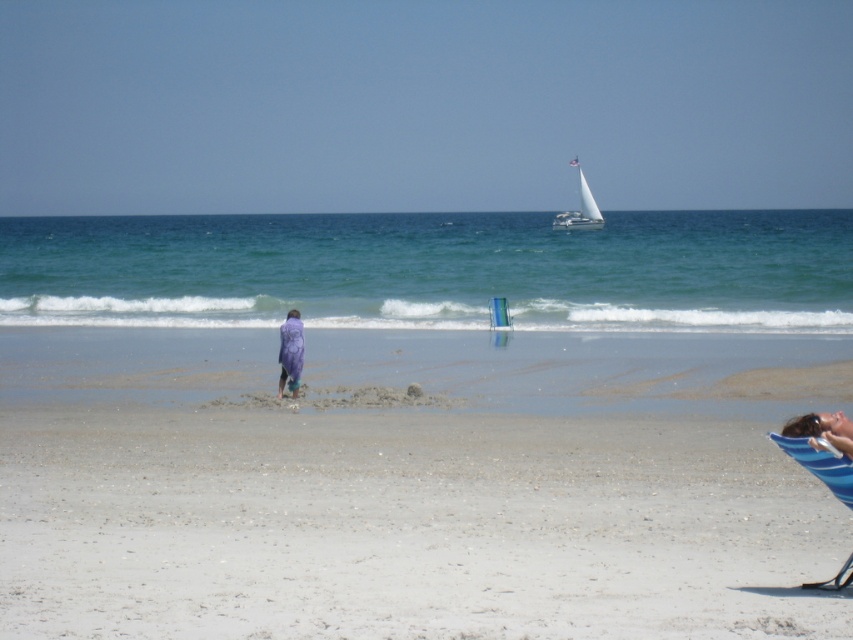
Question: Is green water at center bigger than blue fabric beach chair at lower right?

Choices:
 (A) yes
 (B) no

Answer: (A)

Question: Which point is farther to the camera?

Choices:
 (A) (294, 340)
 (B) (569, 225)
 (C) (805, 460)

Answer: (B)

Question: Which object is farther from the camera taking this photo?

Choices:
 (A) white sailboat at upper center
 (B) purple towel at center

Answer: (A)

Question: Does green water at center appear over blonde hair person at lower right?

Choices:
 (A) yes
 (B) no

Answer: (A)

Question: Observing the image, what is the correct spatial positioning of green water at center in reference to transparent plastic chair at center?

Choices:
 (A) left
 (B) right

Answer: (B)

Question: Which point is closer to the camera?

Choices:
 (A) 720,241
 (B) 805,426
 (C) 590,205

Answer: (B)